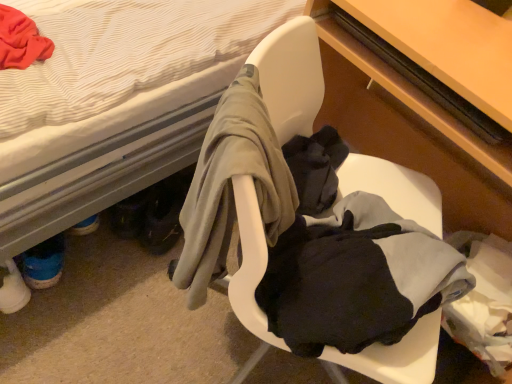
Question: From their relative heights in the image, would you say white plastic chair at center is taller or shorter than matte wood desk at center?

Choices:
 (A) tall
 (B) short

Answer: (B)

Question: Considering the positions of point (246, 316) and point (481, 205), is point (246, 316) closer or farther from the camera than point (481, 205)?

Choices:
 (A) farther
 (B) closer

Answer: (B)

Question: Estimate the real-world distances between objects in this image. Which object is closer to the white fabric bed at upper left?

Choices:
 (A) matte wood desk at center
 (B) white plastic chair at center
 (C) wooden table at right

Answer: (B)

Question: Considering the real-world distances, which object is closest to the wooden table at right?

Choices:
 (A) matte wood desk at center
 (B) white plastic chair at center
 (C) white fabric bed at upper left

Answer: (A)